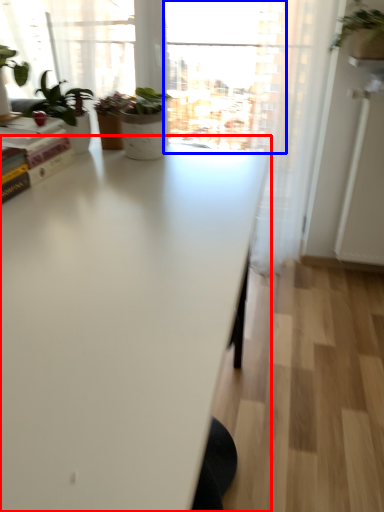
Question: Among these objects, which one is nearest to the camera, table (highlighted by a red box) or window (highlighted by a blue box)?

Choices:
 (A) table
 (B) window

Answer: (A)